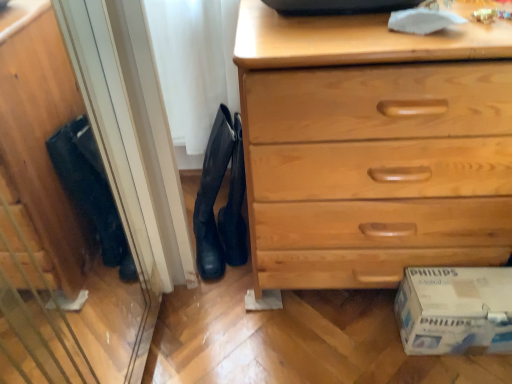
Locate an element on the screen. vacant space in between light wood chest of drawers at lower right and white cardboard box at lower right is located at coordinates (346, 333).